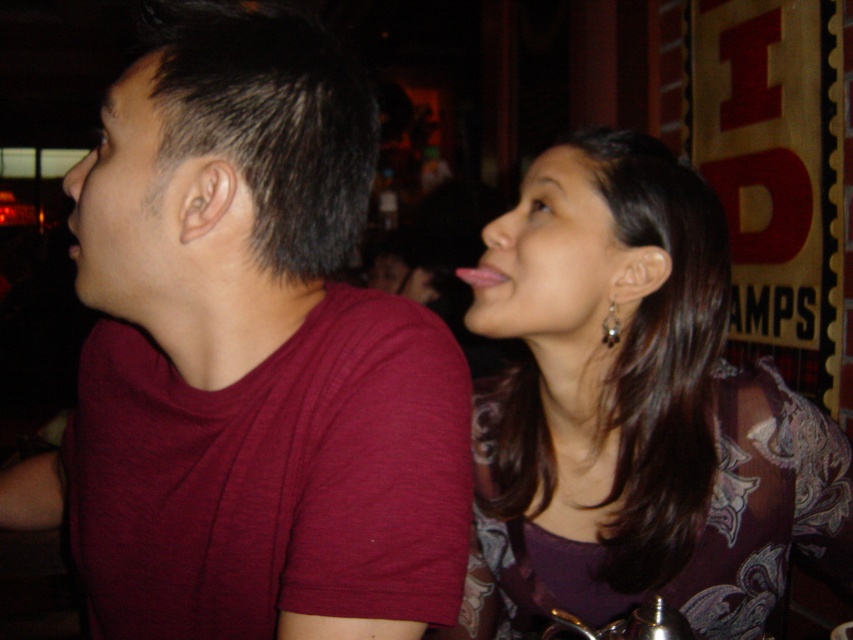
You are a photographer trying to capture a closeup shot of the silver metallic earring at upper right without including the matte purple blouse at upper right. Based on their positions, is this possible?

The matte purple blouse at upper right might be wider than silver metallic earring at upper right, so it might block the view of the earring. It might not be possible to capture the earring without the blouse in the frame.